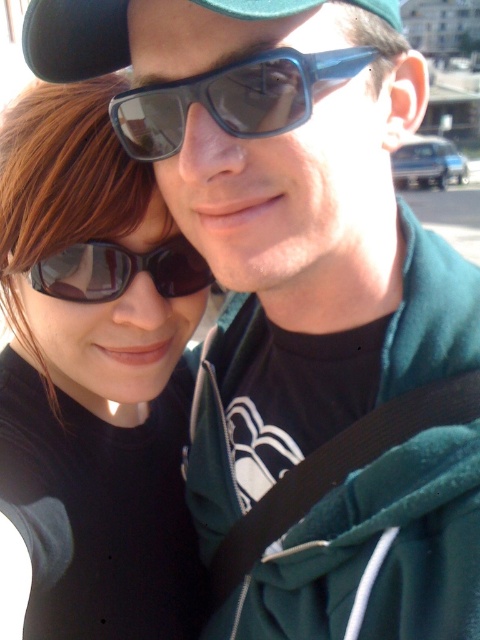
Question: Does matte black sunglasses at left have a larger size compared to matte black sunglasses at center?

Choices:
 (A) yes
 (B) no

Answer: (A)

Question: Does matte dark blue sunglasses at center have a greater width compared to matte black sunglasses at center?

Choices:
 (A) yes
 (B) no

Answer: (A)

Question: Which of these objects is positioned farthest from the green fabric baseball cap at upper center?

Choices:
 (A) matte dark blue sunglasses at center
 (B) matte black sunglasses at left
 (C) matte black sunglasses at center

Answer: (B)

Question: Which of the following is the farthest from the observer?

Choices:
 (A) (310, 60)
 (B) (36, 67)
 (C) (58, 548)

Answer: (C)

Question: Which object is positioned closest to the matte black sunglasses at center?

Choices:
 (A) matte black sunglasses at left
 (B) green fabric baseball cap at upper center

Answer: (A)

Question: Does matte black sunglasses at left have a greater width compared to green fabric baseball cap at upper center?

Choices:
 (A) yes
 (B) no

Answer: (A)